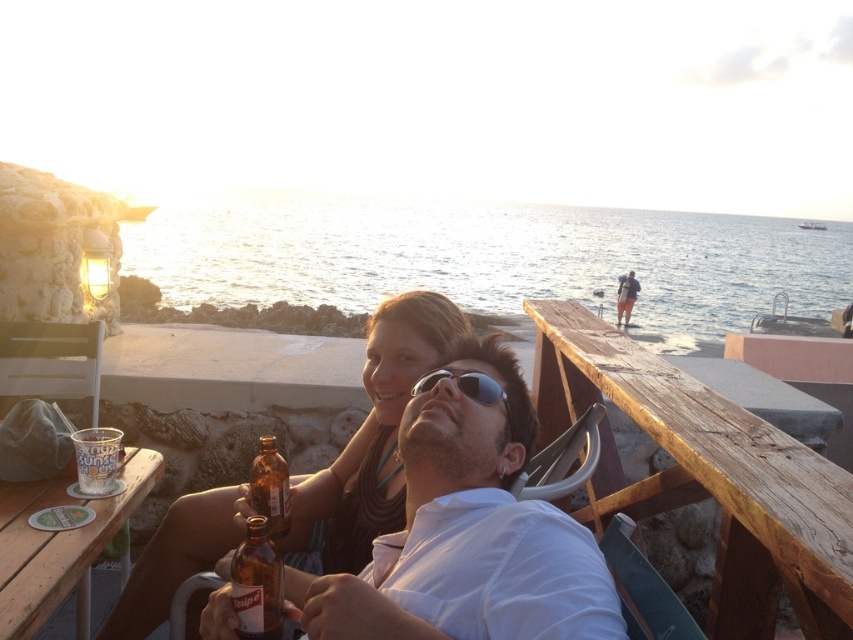
You are standing in front of the wooden table in the seaside scene. You notice two points marked on the table. Which point is closer to you, point (x=512, y=492) or point (x=625, y=323)?

Point (x=512, y=492) is closer to the viewer than point (x=625, y=323).

You are a photographer standing behind the wooden table at lower left and the clear plastic cup at table left. You want to take a photo of the cup without the table being in the frame. Should you move forward or backward?

The wooden table at lower left is below the clear plastic cup at table left. To avoid the table in the frame, you should move forward so the table moves out of the camera view below the cup.

You are planning to place a small potted plant between the metallic silver chair at lower center and the dark blue jeans at upper right. Based on their sizes, will the plant fit comfortably between them?

The metallic silver chair at lower center is smaller than the dark blue jeans at upper right, so there should be enough space to place a small potted plant between them comfortably.